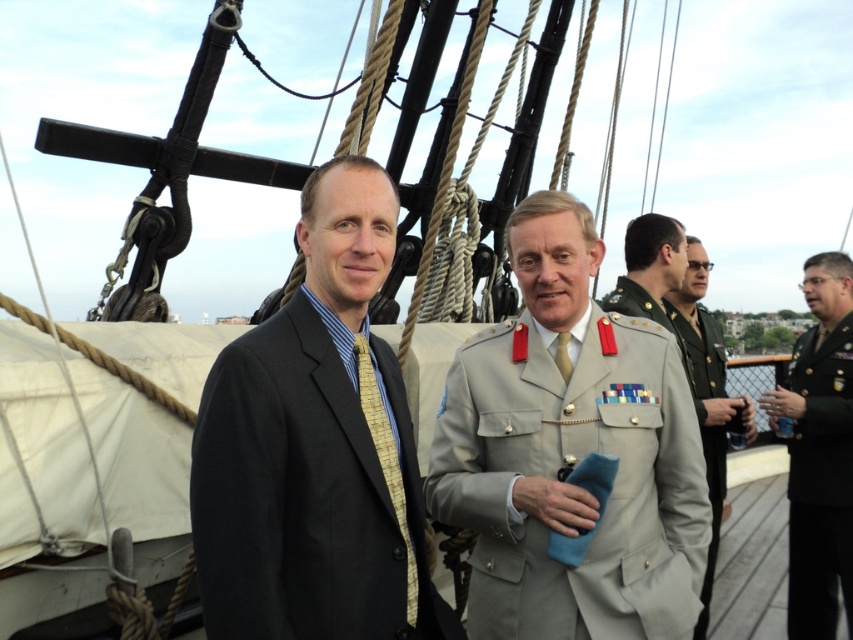
Question: Observing the image, what is the correct spatial positioning of khaki military uniform at center in reference to light beige uniform at center?

Choices:
 (A) below
 (B) above

Answer: (B)

Question: Does light gray military uniform at center appear over matte black suit at center?

Choices:
 (A) no
 (B) yes

Answer: (B)

Question: Which object appears farthest from the camera in this image?

Choices:
 (A) yellow silk tie at center
 (B) light beige uniform at center
 (C) dark green military uniform at right
 (D) khaki military uniform at center

Answer: (C)

Question: Estimate the real-world distances between objects in this image. Which object is closer to the khaki military uniform at center?

Choices:
 (A) yellow silk tie at center
 (B) matte black suit at center

Answer: (A)

Question: Which of these objects is positioned closest to the light beige uniform at center?

Choices:
 (A) yellowstriped fabrictie at left
 (B) dark green military uniform at right

Answer: (B)

Question: Is matte black suit at center to the right of yellow silk tie at center from the viewer's perspective?

Choices:
 (A) yes
 (B) no

Answer: (B)